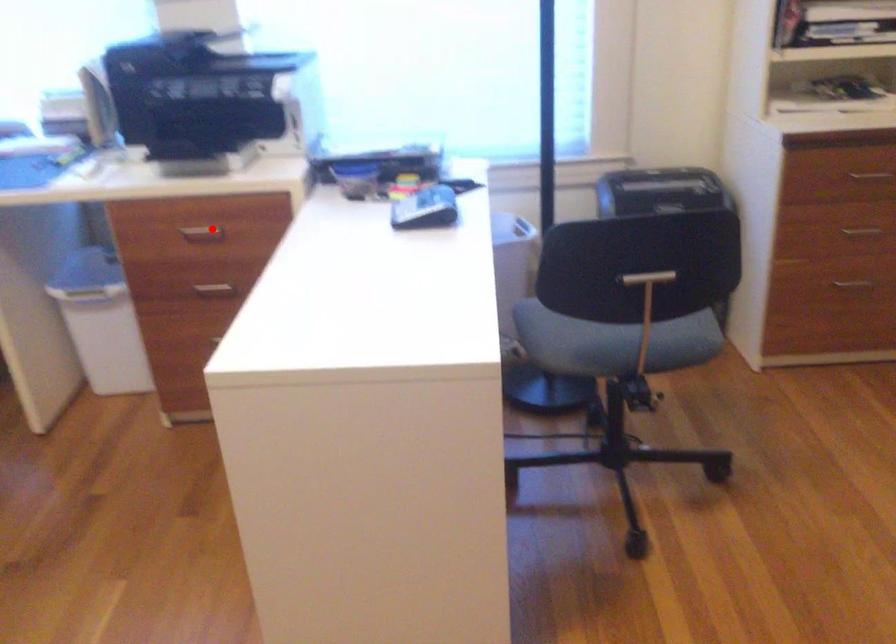
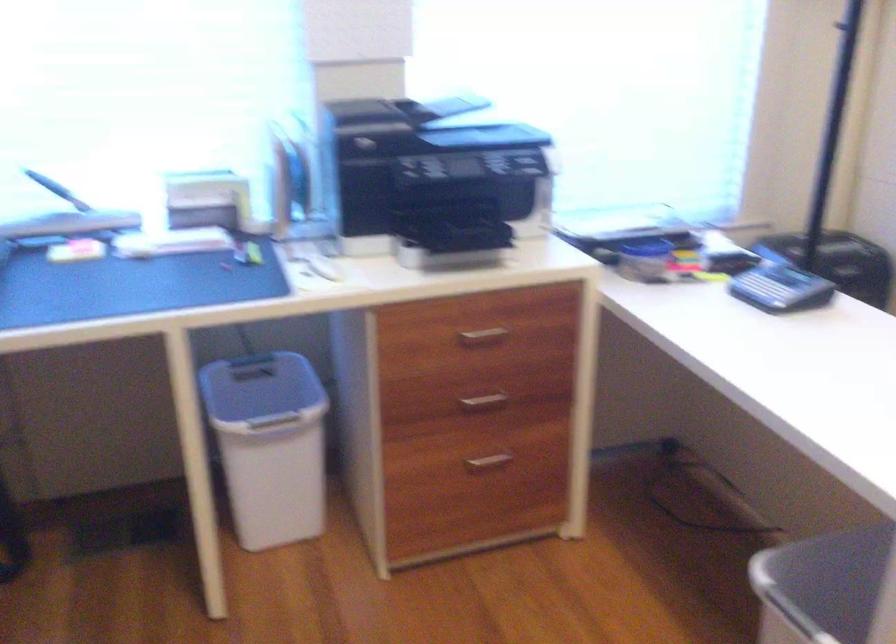
Question: I am providing you with two images of the same scene from different viewpoints. A red point is shown in image1. For the corresponding object point in image2, is it positioned nearer or farther from the camera?

Choices:
 (A) Nearer
 (B) Farther

Answer: (A)